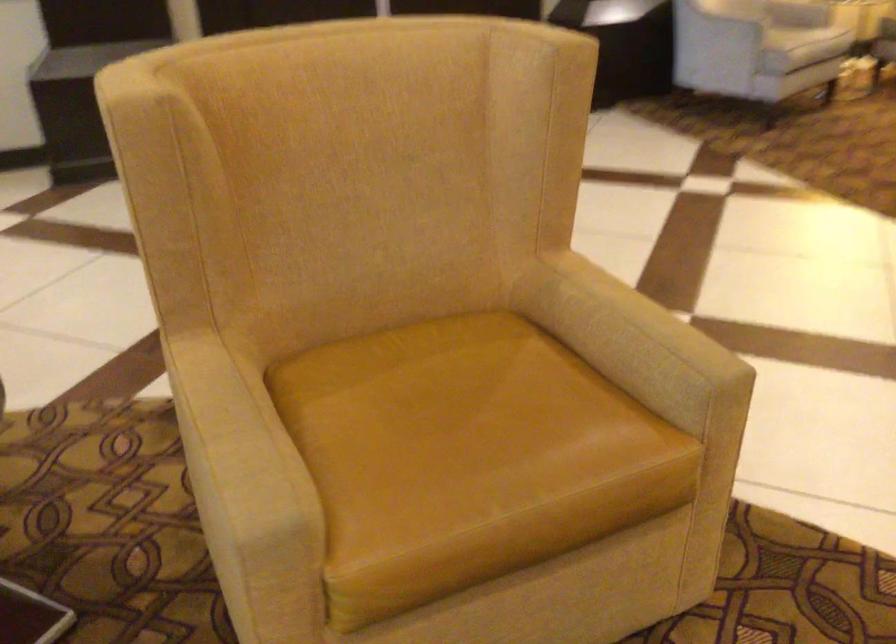
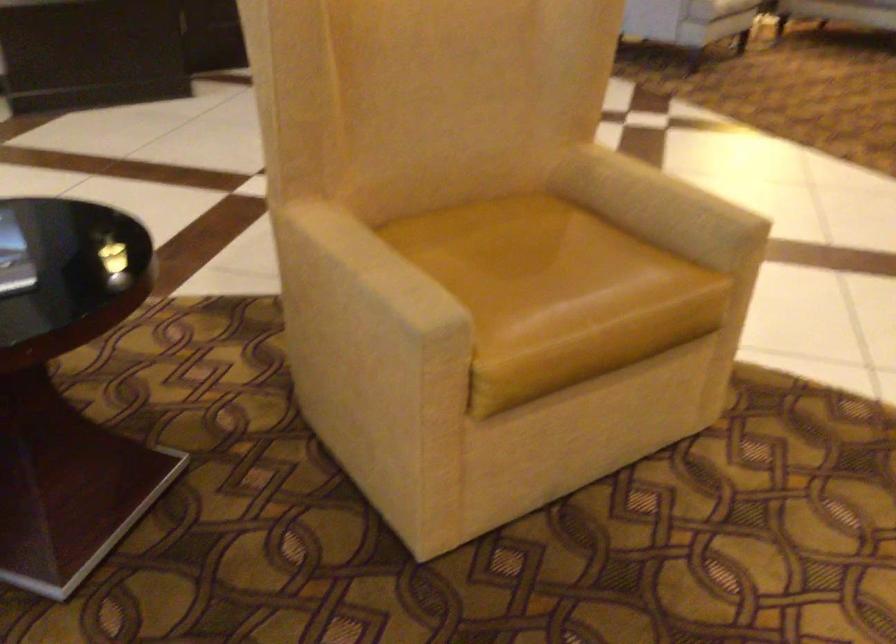
In the second image, find the point that corresponds to (625,342) in the first image.

(659, 205)